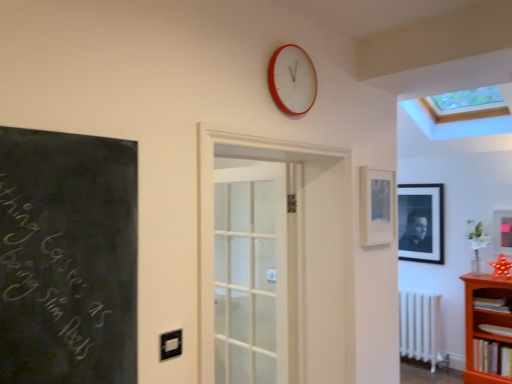
Describe the element at coordinates (292, 251) in the screenshot. Image resolution: width=512 pixels, height=384 pixels. I see `white glass door at center` at that location.

Describe the element at coordinates (492, 357) in the screenshot. The height and width of the screenshot is (384, 512). I see `hardcover book at lower right, positioned as the third book in top-to-bottom order` at that location.

From the picture: What is the approximate width of hardcover book at lower right, positioned as the third book in top-to-bottom order?

hardcover book at lower right, positioned as the third book in top-to-bottom order, is 10.23 inches in width.

What is the approximate height of red plastic wall clock at upper center?

It is 31.73 centimeters.

This screenshot has height=384, width=512. Describe the element at coordinates (420, 327) in the screenshot. I see `white matte radiator at lower right` at that location.

Locate an element on the screen. The image size is (512, 384). black matte picture frame at upper right, which is the second picture frame in right-to-left order is located at coordinates (421, 222).

Considering the positions of point (410, 310) and point (493, 332), is point (410, 310) closer or farther from the camera than point (493, 332)?

Point (410, 310) is positioned farther from the camera compared to point (493, 332).

Would you say white matte radiator at lower right is to the left or to the right of matte orange book at lower right, the second book when ordered from top to bottom, in the picture?

white matte radiator at lower right is to the left of matte orange book at lower right, the second book when ordered from top to bottom.

Between white matte radiator at lower right and matte orange book at lower right, the second book when ordered from top to bottom, which one has larger size?

white matte radiator at lower right.

Based on the photo, from a real-world perspective, is white matte radiator at lower right physically located above or below matte orange book at lower right, the second book when ordered from top to bottom?

Clearly, from a real-world perspective, white matte radiator at lower right is below matte orange book at lower right, the second book when ordered from top to bottom.

Considering the relative positions of hardcover book at lower right, positioned as the third book in top-to-bottom order, and transparent glass skylight at upper center in the image provided, is hardcover book at lower right, positioned as the third book in top-to-bottom order, to the left of transparent glass skylight at upper center from the viewer's perspective?

No.

The height and width of the screenshot is (384, 512). Find the location of `window in front of the hardcover book at lower right, marked as the 1th book in a bottom-to-top arrangement`. window in front of the hardcover book at lower right, marked as the 1th book in a bottom-to-top arrangement is located at coordinates pos(455,124).

Is hardcover book at lower right, marked as the 1th book in a bottom-to-top arrangement, spatially inside transparent glass skylight at upper center, or outside of it?

hardcover book at lower right, marked as the 1th book in a bottom-to-top arrangement, lies outside transparent glass skylight at upper center.

How far apart are hardcover book at lower right, positioned as the third book in top-to-bottom order, and transparent glass skylight at upper center?

hardcover book at lower right, positioned as the third book in top-to-bottom order, and transparent glass skylight at upper center are 6.67 feet apart from each other.

Which is more distant, (505, 245) or (301, 89)?

The point (505, 245) is behind.

What are the coordinates of `wall clock above the matte black picture frame at right, acting as the third picture frame starting from the left (from the image's perspective)` in the screenshot? It's located at (292, 80).

Considering the relative sizes of matte black picture frame at right, the second picture frame positioned from the front, and red plastic wall clock at upper center in the image provided, is matte black picture frame at right, the second picture frame positioned from the front, taller than red plastic wall clock at upper center?

Yes.

Consider the image. From a real-world perspective, who is located lower, matte black picture frame at right, the second picture frame positioned from the front, or red plastic wall clock at upper center?

matte black picture frame at right, the second picture frame positioned from the front, is physically lower.

Is matte orange book at lower right, the second book when ordered from top to bottom, oriented towards transparent glass skylight at upper center?

No, matte orange book at lower right, the second book when ordered from top to bottom, is not turned towards transparent glass skylight at upper center.

Considering the relative positions of matte orange book at lower right, acting as the second book starting from the bottom, and transparent glass skylight at upper center in the image provided, is matte orange book at lower right, acting as the second book starting from the bottom, to the left of transparent glass skylight at upper center from the viewer's perspective?

Incorrect, matte orange book at lower right, acting as the second book starting from the bottom, is not on the left side of transparent glass skylight at upper center.

Between point (506, 327) and point (479, 135), which one is positioned behind?

The point (479, 135) is more distant.

How much distance is there between matte orange book at lower right, the second book when ordered from top to bottom, and transparent glass skylight at upper center?

matte orange book at lower right, the second book when ordered from top to bottom, is 1.90 meters away from transparent glass skylight at upper center.

Is white glass door at center to the left or to the right of transparent glass skylight at upper center in the image?

Based on their positions, white glass door at center is located to the left of transparent glass skylight at upper center.

Looking at their sizes, would you say white glass door at center is wider or thinner than transparent glass skylight at upper center?

white glass door at center is thinner than transparent glass skylight at upper center.

Who is taller, white glass door at center or transparent glass skylight at upper center?

With more height is white glass door at center.

Is white glass door at center completely or partially outside of transparent glass skylight at upper center?

Yes.

Is matte black picture frame at right, which is the 2th picture frame from back to front, thinner than orange wood bookshelf at lower right?

Correct, the width of matte black picture frame at right, which is the 2th picture frame from back to front, is less than that of orange wood bookshelf at lower right.

From the picture: Considering the relative sizes of matte black picture frame at right, which is the 2th picture frame from back to front, and orange wood bookshelf at lower right in the image provided, is matte black picture frame at right, which is the 2th picture frame from back to front, shorter than orange wood bookshelf at lower right?

Yes.

Is matte black picture frame at right, the 1th picture frame from the right, touching orange wood bookshelf at lower right?

No, matte black picture frame at right, the 1th picture frame from the right, is not next to orange wood bookshelf at lower right.

Is matte black picture frame at right, which is the 2th picture frame from back to front, positioned with its back to orange wood bookshelf at lower right?

That's not correct — matte black picture frame at right, which is the 2th picture frame from back to front, is not looking away from orange wood bookshelf at lower right.

Is hardcover book at lower right, acting as the first book starting from the top, at the back of orange wood bookshelf at lower right?

Yes, orange wood bookshelf at lower right's orientation is away from hardcover book at lower right, acting as the first book starting from the top.

Considering the relative sizes of orange wood bookshelf at lower right and hardcover book at lower right, which is counted as the 3th book, starting from the bottom, in the image provided, is orange wood bookshelf at lower right wider than hardcover book at lower right, which is counted as the 3th book, starting from the bottom,?

Yes.

Who is bigger, orange wood bookshelf at lower right or hardcover book at lower right, which is counted as the 3th book, starting from the bottom?

With larger size is orange wood bookshelf at lower right.

Locate an element on the screen. The width and height of the screenshot is (512, 384). radiator on the left of matte orange book at lower right, acting as the second book starting from the bottom is located at coordinates (420, 327).

Identify the location of window lying in front of the hardcover book at lower right, positioned as the third book in top-to-bottom order. (455, 124).

Considering their positions, is red plastic wall clock at upper center positioned closer to white glass door at center than matte black picture frame at upper right, which appears as the 3th picture frame when viewed from the right?

The object closer to white glass door at center is matte black picture frame at upper right, which appears as the 3th picture frame when viewed from the right.

Which object lies nearer to the anchor point hardcover book at lower right, marked as the 1th book in a bottom-to-top arrangement, red plastic wall clock at upper center or orange wood bookshelf at lower right?

orange wood bookshelf at lower right is positioned closer to the anchor hardcover book at lower right, marked as the 1th book in a bottom-to-top arrangement.

In the scene shown: Which object lies nearer to the anchor point hardcover book at lower right, marked as the 1th book in a bottom-to-top arrangement, orange wood bookshelf at lower right or white matte radiator at lower right?

orange wood bookshelf at lower right is closer to hardcover book at lower right, marked as the 1th book in a bottom-to-top arrangement.

Estimate the real-world distances between objects in this image. Which object is closer to transparent glass skylight at upper center, white glass door at center or orange wood bookshelf at lower right?

orange wood bookshelf at lower right.

From the image, which object appears to be farther from red plastic wall clock at upper center, matte orange book at lower right, acting as the second book starting from the bottom, or hardcover book at lower right, positioned as the third book in top-to-bottom order?

matte orange book at lower right, acting as the second book starting from the bottom, is further to red plastic wall clock at upper center.

Considering their positions, is red plastic wall clock at upper center positioned further to black matte picture frame at upper right, the 1th picture frame viewed from the back, than white glass door at center?

Among the two, red plastic wall clock at upper center is located further to black matte picture frame at upper right, the 1th picture frame viewed from the back.

When comparing their distances from white matte radiator at lower right, does black matte picture frame at upper right, which is the second picture frame in right-to-left order, or hardcover book at lower right, positioned as the third book in top-to-bottom order, seem closer?

The object closer to white matte radiator at lower right is hardcover book at lower right, positioned as the third book in top-to-bottom order.

Based on their spatial positions, is black matte picture frame at upper right, the third picture frame from the front, or hardcover book at lower right, acting as the first book starting from the top, further from white glass door at center?

hardcover book at lower right, acting as the first book starting from the top, lies further to white glass door at center than the other object.

This screenshot has width=512, height=384. Find the location of `picture frame between black matte picture frame at upper right, acting as the second picture frame starting from the left, and white matte radiator at lower right in the up-down direction`. picture frame between black matte picture frame at upper right, acting as the second picture frame starting from the left, and white matte radiator at lower right in the up-down direction is located at coordinates (503, 231).

Identify the location of picture frame between black matte picture frame at upper right, acting as the second picture frame starting from the left, and hardcover book at lower right, marked as the 1th book in a bottom-to-top arrangement, in the up-down direction. (503, 231).

Identify the location of shelf between transparent glass skylight at upper center and white matte radiator at lower right in the vertical direction. (484, 322).

Locate an element on the screen. This screenshot has width=512, height=384. shelf positioned between white glass door at center and white matte radiator at lower right from near to far is located at coordinates (484, 322).